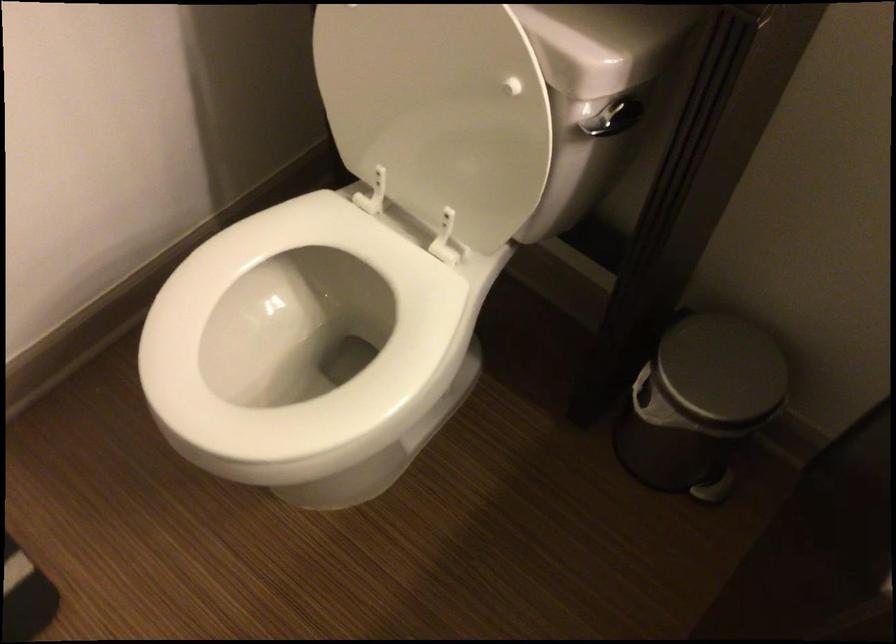
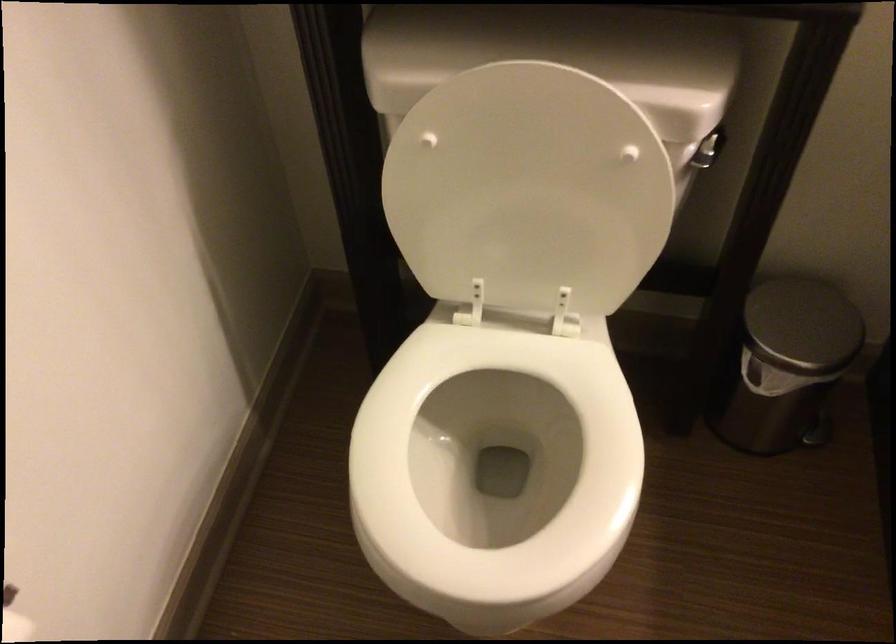
Locate, in the second image, the point that corresponds to pixel 425 88 in the first image.

(528, 189)